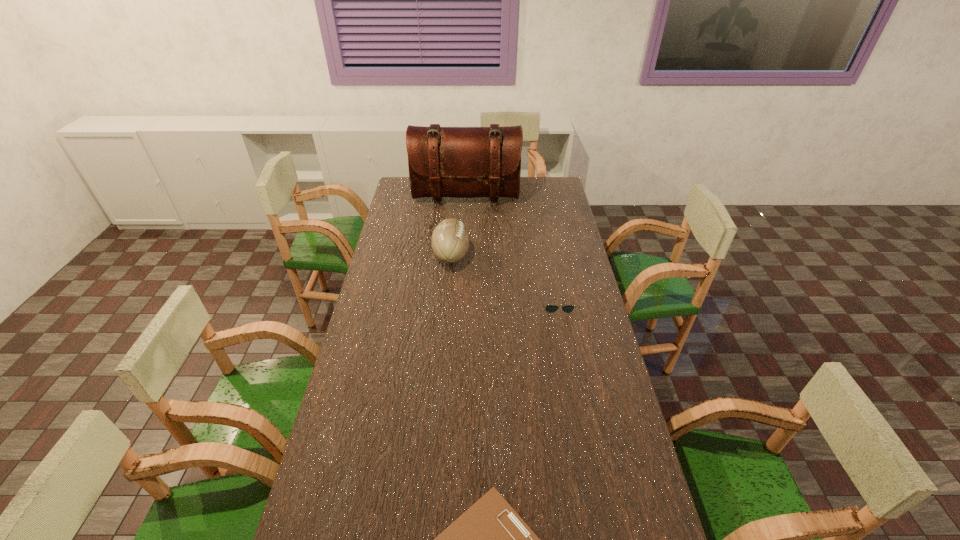
You are a GUI agent. You are given a task and a screenshot of the screen. Output one action in this format:
    pyautogui.click(x=<x>, y=<y>)
    Task: Click on the object present at the left edge
    
    Given the screenshot: What is the action you would take?
    pyautogui.click(x=461, y=162)

Where is `object positioned at the right edge`? This screenshot has height=540, width=960. object positioned at the right edge is located at coordinates (549, 308).

The width and height of the screenshot is (960, 540). I want to click on object that is at the far left corner, so click(x=461, y=162).

Find the location of a particular element. This screenshot has height=540, width=960. vacant space at the left edge of the desktop is located at coordinates (379, 420).

You are a GUI agent. You are given a task and a screenshot of the screen. Output one action in this format:
    pyautogui.click(x=<x>, y=<y>)
    Task: Click on the vacant space at the right edge
    This screenshot has height=540, width=960.
    Given the screenshot: What is the action you would take?
    click(x=617, y=536)

Find the location of a particular element. free space at the far left corner of the desktop is located at coordinates (399, 199).

Locate an element on the screen. Image resolution: width=960 pixels, height=540 pixels. empty location between the second nearest object and the second farthest object is located at coordinates (505, 280).

Identify the location of free space between the satchel and the second nearest object. (512, 250).

You are a GUI agent. You are given a task and a screenshot of the screen. Output one action in this format:
    pyautogui.click(x=<x>, y=<y>)
    Task: Click on the object that stands as the third closest to the nearest object
    The width and height of the screenshot is (960, 540).
    Given the screenshot: What is the action you would take?
    pyautogui.click(x=461, y=162)

Where is `object that is the second closest one to the clipboard`? Image resolution: width=960 pixels, height=540 pixels. object that is the second closest one to the clipboard is located at coordinates (450, 240).